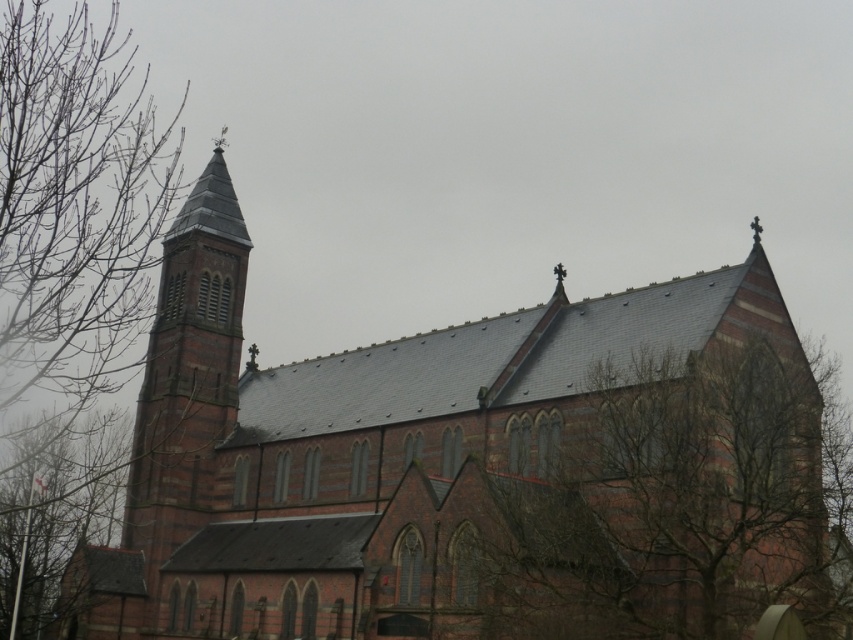
You are standing in front of the Gothic church and notice two sets of bare branches. One is labeled as bare branches at lower right and the other as bare branches at left. From your perspective, which set of branches is positioned to the right of the other?

The bare branches at lower right is positioned on the right side of bare branches at left.

You are standing in front of the Gothic church and notice two points marked on the image. The first point is at coordinate point (721, 378) and the second is at point (6, 228). Which point is closer to you?

Point (6, 228) is closer to you because it is in front of point (721, 378).